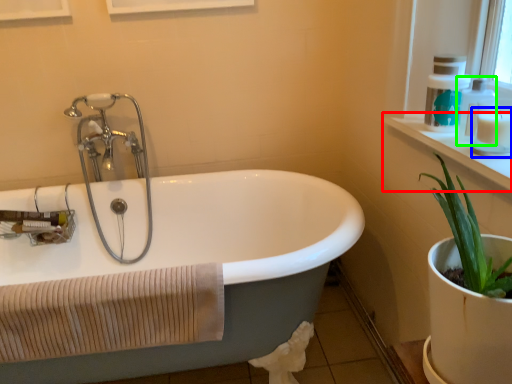
Question: Which is nearer to the window sill (highlighted by a red box)? toiletry (highlighted by a blue box) or soap dispenser (highlighted by a green box).

Choices:
 (A) toiletry
 (B) soap dispenser

Answer: (B)